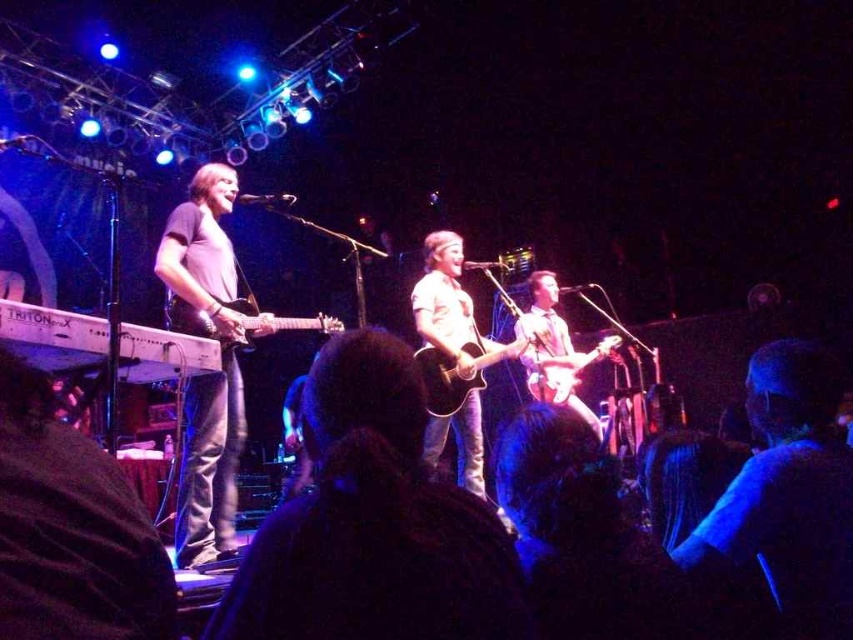
You are a photographer at the back of the venue and want to capture a clear photo of both the blue fabric shirt at center and the light brown acoustic guitar at center. Since you can only focus on one object at a time, which one should you choose to ensure the other remains in the background but still recognizable?

The blue fabric shirt at center is smaller than the light brown acoustic guitar at center. Therefore, to ensure both are recognizable, focus on the light brown acoustic guitar at center because its larger size will remain visible even in the background.

You are a photographer at the back of the venue and want to take a clear photo of the light brown acoustic guitar at center without the blue fabric shirt at center blocking it. What should you do?

The blue fabric shirt at center is in front of the light brown acoustic guitar at center, so you should move to a position where you can see behind the blue fabric shirt at center to capture the light brown acoustic guitar at center without obstruction.

You are a stagehand who needs to ensure that the blue fabric shirt at center and the matte brown guitar at center do not block the spotlight. Which object should you adjust first to avoid blocking the light, considering their sizes?

The blue fabric shirt at center has a smaller size compared to the matte brown guitar at center. Since the guitar is larger, it is more likely to block the spotlight first, so adjust the matte brown guitar at center first.